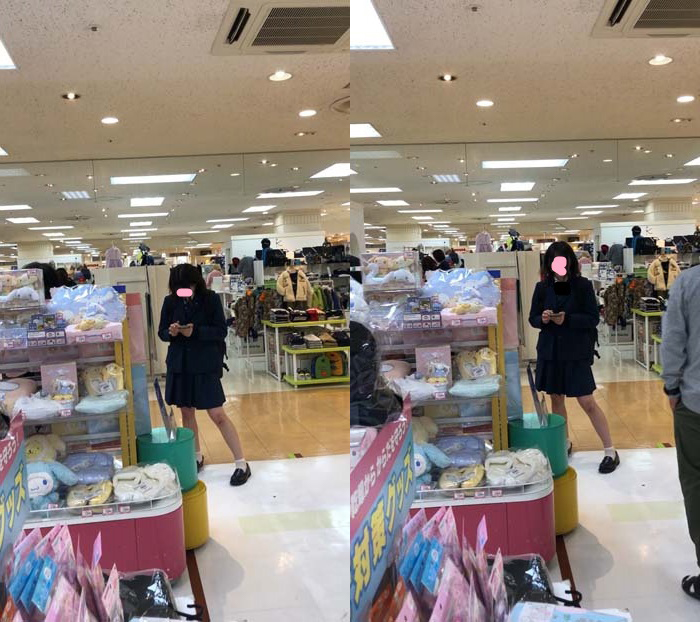
Image resolution: width=700 pixels, height=622 pixels. Identify the location of floor. (620, 529), (284, 527).